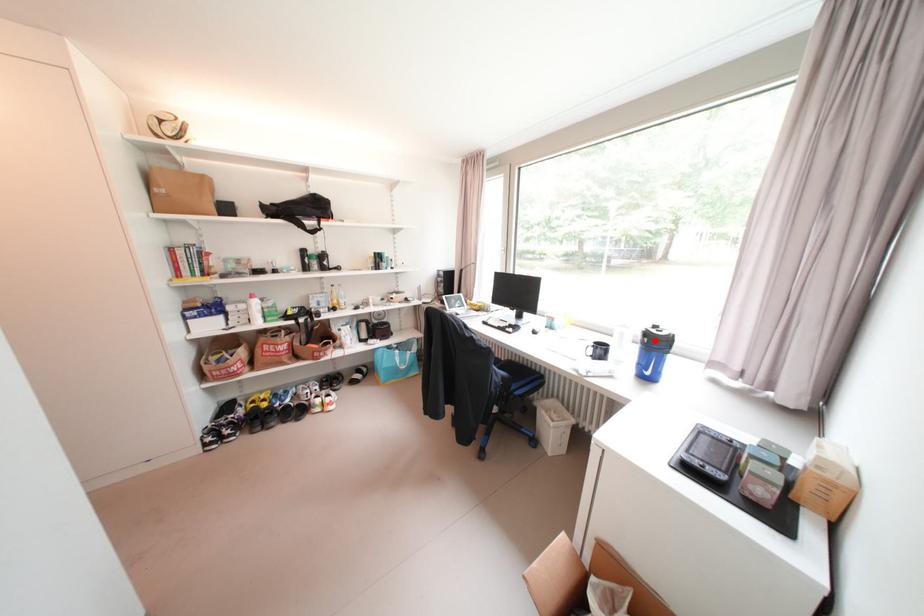
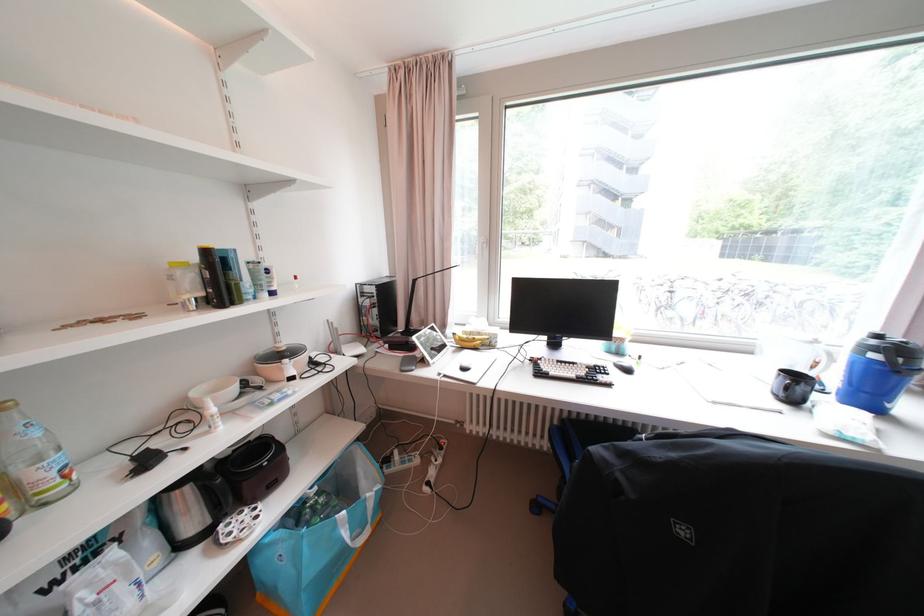
In the second image, find the point that corresponds to the highlighted location in the first image.

(909, 361)